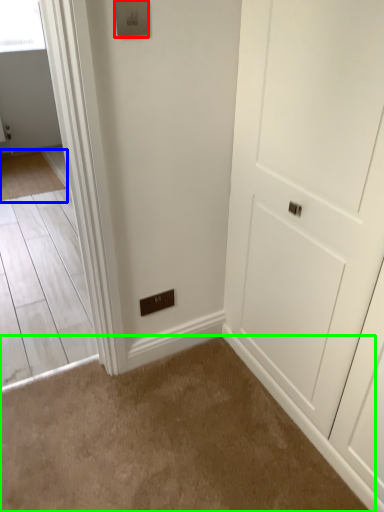
Question: Based on their relative distances, which object is nearer to light switch (highlighted by a red box)? Choose from mat (highlighted by a blue box) and plain (highlighted by a green box).

Choices:
 (A) mat
 (B) plain

Answer: (B)